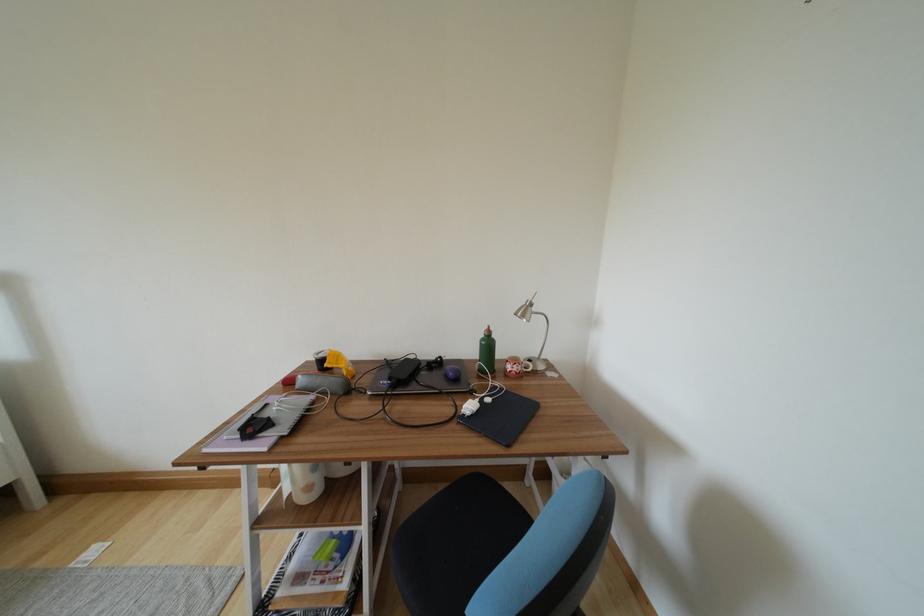
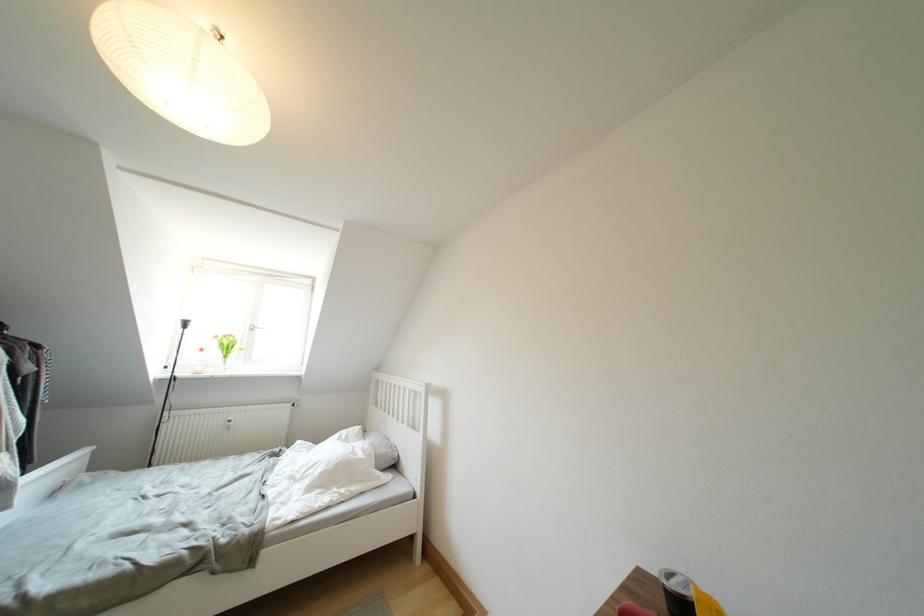
In the second image, find the point that corresponds to (325,360) in the first image.

(678, 589)